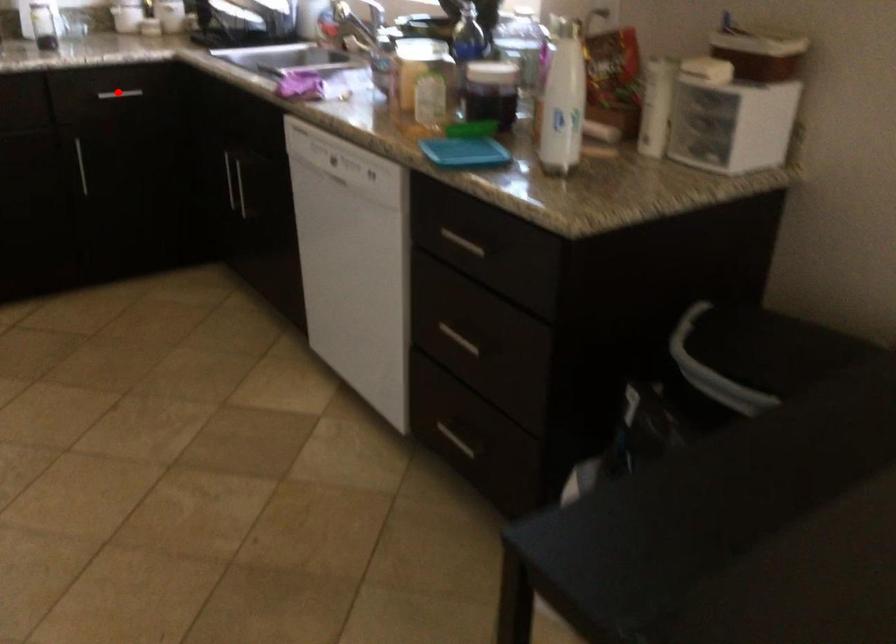
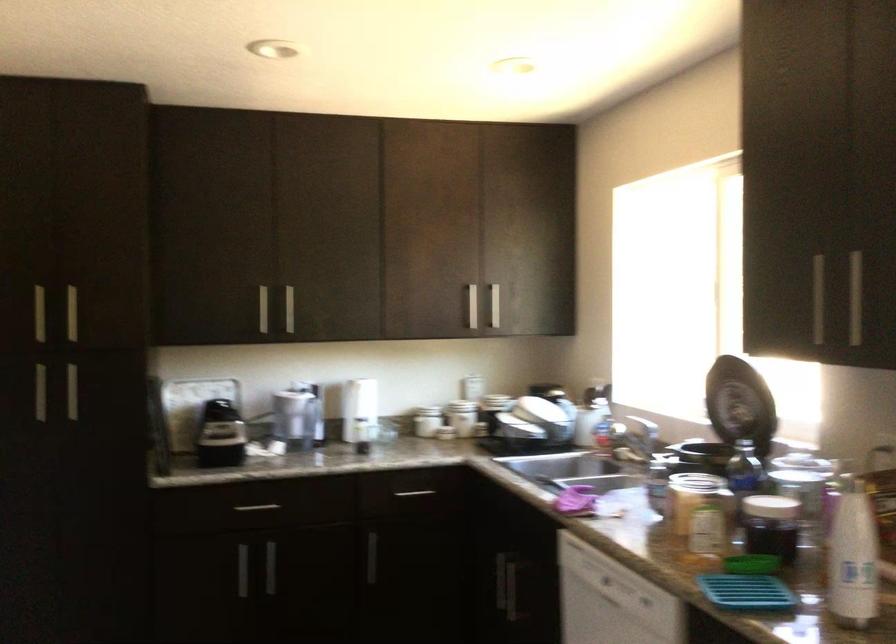
Where in the second image is the point corresponding to the highlighted location from the first image?

(414, 493)